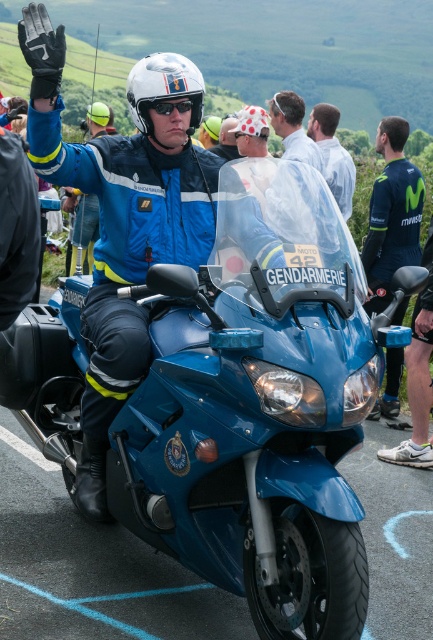
Question: Does blue glossy motorcycle at center appear over white matte helmet at center?

Choices:
 (A) no
 (B) yes

Answer: (A)

Question: Can you confirm if matte blue motorcycle at center is positioned to the left of white matte helmet at center?

Choices:
 (A) no
 (B) yes

Answer: (B)

Question: Which of the following is the farthest from the observer?

Choices:
 (A) (155, 77)
 (B) (397, 369)
 (C) (268, 113)

Answer: (C)

Question: Which of the following is the closest to the observer?

Choices:
 (A) white matte helmet at center
 (B) black matte goggles at center

Answer: (A)

Question: Does blue glossy motorcycle at center appear on the right side of white cotton shirt at upper center?

Choices:
 (A) yes
 (B) no

Answer: (B)

Question: Among these points, which one is farthest from the camera?

Choices:
 (A) 294,106
 (B) 165,54
 (C) 187,154
 (D) 187,108

Answer: (A)